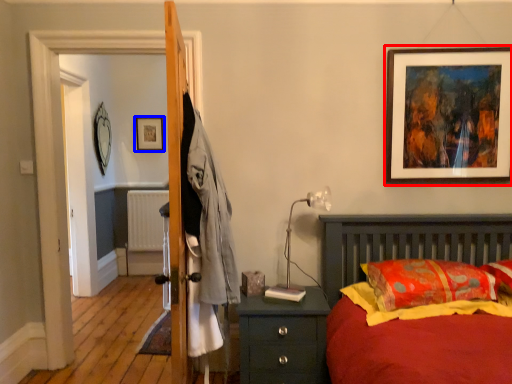
Question: Which object appears farthest to the camera in this image, picture frame (highlighted by a red box) or picture frame (highlighted by a blue box)?

Choices:
 (A) picture frame
 (B) picture frame

Answer: (B)